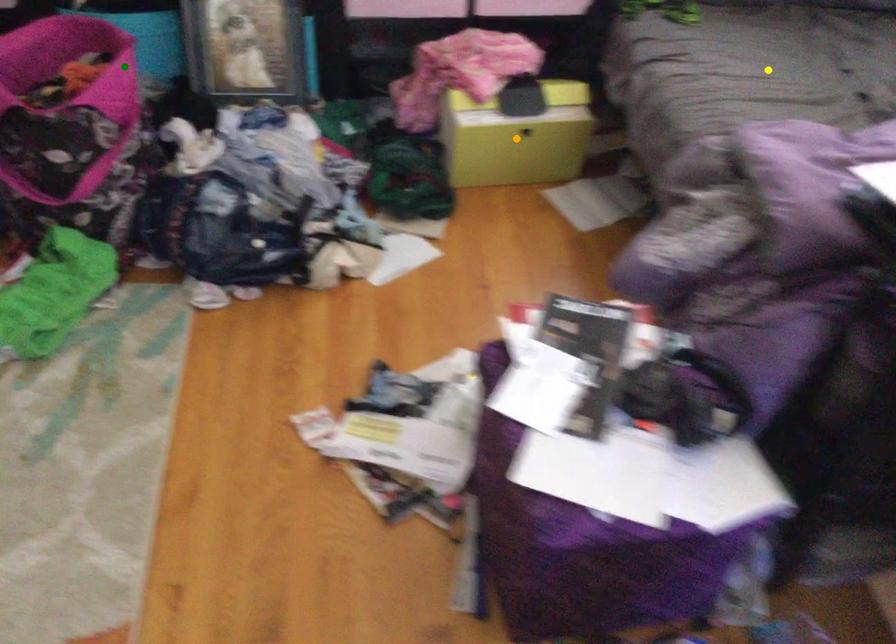
Order these from nearest to farthest:
1. yellow point
2. green point
3. orange point

orange point < yellow point < green point